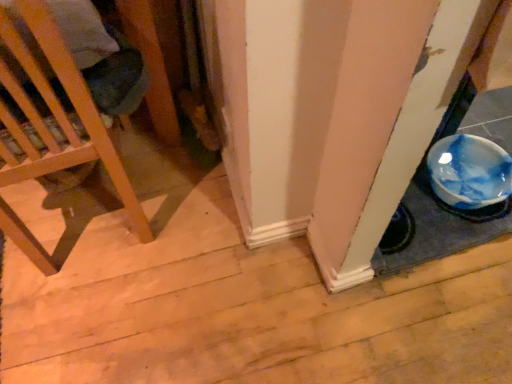
Locate an element on the screen. The image size is (512, 384). wooden chair at left is located at coordinates point(58,113).

This screenshot has height=384, width=512. Describe the element at coordinates (58, 113) in the screenshot. I see `wooden chair at left` at that location.

The image size is (512, 384). Identify the location of wooden chair at left. (58, 113).